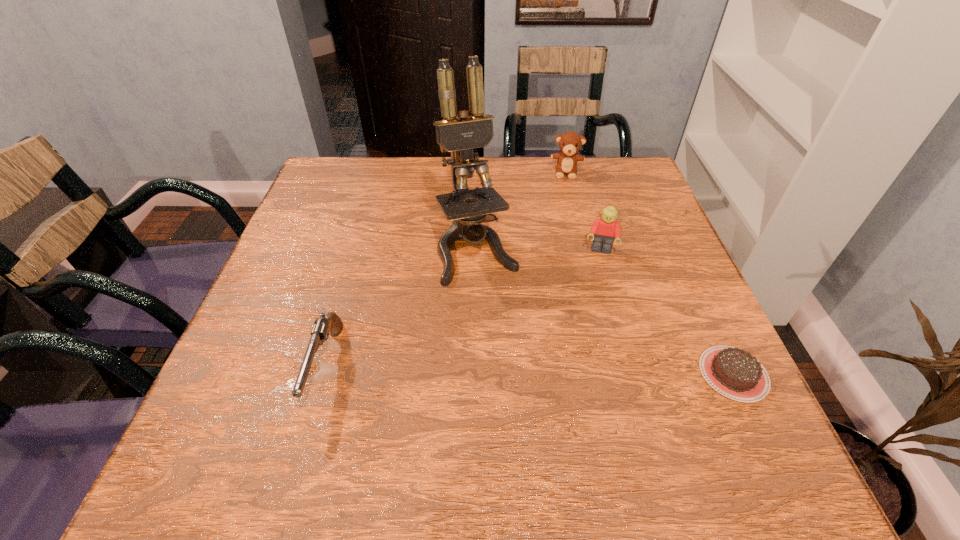
This screenshot has height=540, width=960. Find the location of `chocolate cake at the near edge`. chocolate cake at the near edge is located at coordinates coord(736,374).

Where is `chocolate cake present at the right edge`? The height and width of the screenshot is (540, 960). chocolate cake present at the right edge is located at coordinates (736, 374).

I want to click on teddy bear situated at the right edge, so click(x=570, y=142).

I want to click on Lego at the right edge, so click(606, 229).

I want to click on object located at the far right corner, so click(570, 142).

Locate an element on the screen. object located at the near right corner is located at coordinates (736, 374).

Where is `free region at the far edge`? free region at the far edge is located at coordinates (398, 170).

The height and width of the screenshot is (540, 960). What are the coordinates of `free spot at the near edge of the desktop` in the screenshot? It's located at (530, 411).

Locate an element on the screen. free location at the right edge is located at coordinates (638, 230).

Locate an element on the screen. blank area at the far left corner is located at coordinates (379, 160).